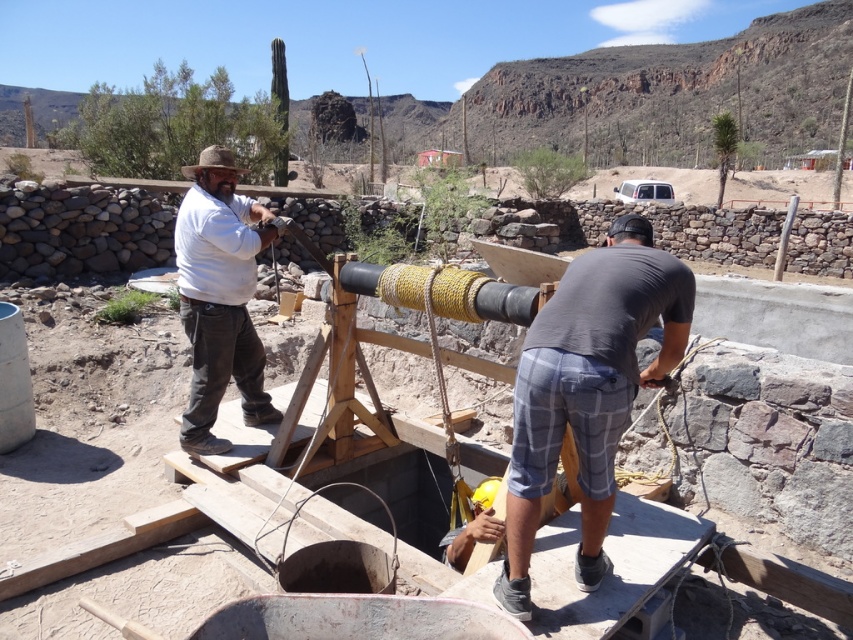
You are a safety inspector observing the construction site. You notice two objects at the center of the scene, the gray plaid shorts at center and the wooden frame at center. Which object should you prioritize inspecting for safety concerns, and why?

The wooden frame at center should be prioritized for inspection because it is larger than the gray plaid shorts at center and likely supports structural loads, making it critical to ensure its stability and safety.

You are an engineer inspecting the construction site. You need to determine if the gray plaid shorts at center can be placed on top of the wooden frame at center without overhanging. Can you confirm?

The gray plaid shorts at center has a lesser width compared to wooden frame at center, so it can be placed on top without overhanging.

You are an observer standing at the edge of the construction site. You see the gray plaid shorts at center and the matte white shirt at center. Which one appears closer to you?

The gray plaid shorts at center is in front of the matte white shirt at center, so the gray plaid shorts at center appears closer to you.